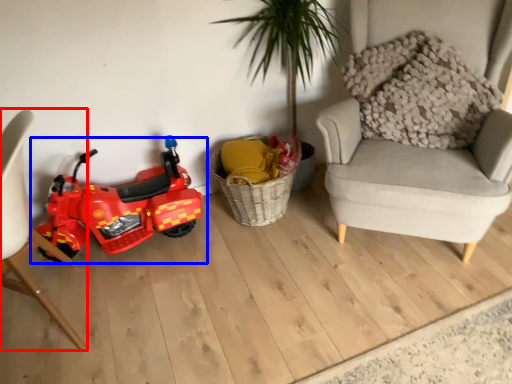
Question: Among these objects, which one is farthest to the camera, chair (highlighted by a red box) or land vehicle (highlighted by a blue box)?

Choices:
 (A) chair
 (B) land vehicle

Answer: (B)